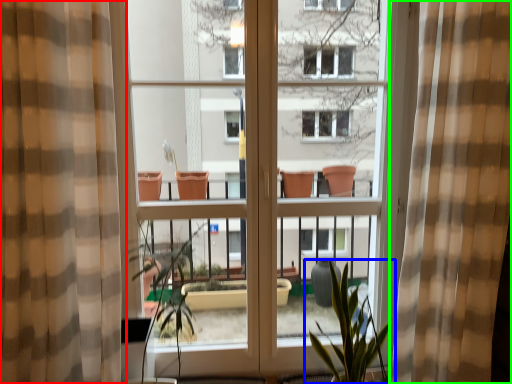
Question: Based on their relative distances, which object is nearer to curtain (highlighted by a red box)? Choose from houseplant (highlighted by a blue box) and curtain (highlighted by a green box).

Choices:
 (A) houseplant
 (B) curtain

Answer: (A)